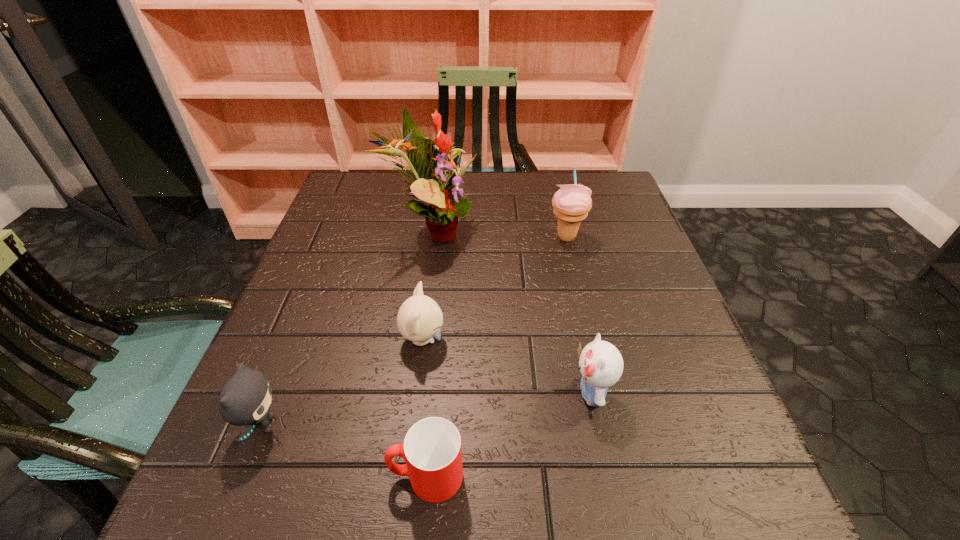
Identify the location of vacant area that lies between the cup and the second tallest object. pos(496,356).

Find the location of a particular element. The image size is (960, 540). vacant area that lies between the leftmost kitten and the fourth nearest object is located at coordinates (343, 382).

Identify the location of free space that is in between the cup and the leftmost kitten. (345, 451).

The height and width of the screenshot is (540, 960). I want to click on vacant point located between the rightmost kitten and the icecream, so click(579, 315).

Locate an element on the screen. empty space that is in between the leftmost object and the rightmost kitten is located at coordinates (426, 409).

I want to click on free space between the second tallest object and the farthest kitten, so click(x=494, y=288).

The image size is (960, 540). I want to click on empty space that is in between the cup and the rightmost kitten, so click(x=509, y=435).

This screenshot has height=540, width=960. I want to click on free space between the bouquet and the rightmost kitten, so click(x=511, y=313).

Identify which object is the closest to the fifth shortest object. Please provide its 2D coordinates. Your answer should be formatted as a tuple, i.e. [(x, y)], where the tuple contains the x and y coordinates of a point satisfying the conditions above.

[(445, 203)]

You are a GUI agent. You are given a task and a screenshot of the screen. Output one action in this format:
    pyautogui.click(x=<x>, y=<y>)
    Task: Click on the object that is the third nearest to the leftmost object
    
    Given the screenshot: What is the action you would take?
    pyautogui.click(x=445, y=203)